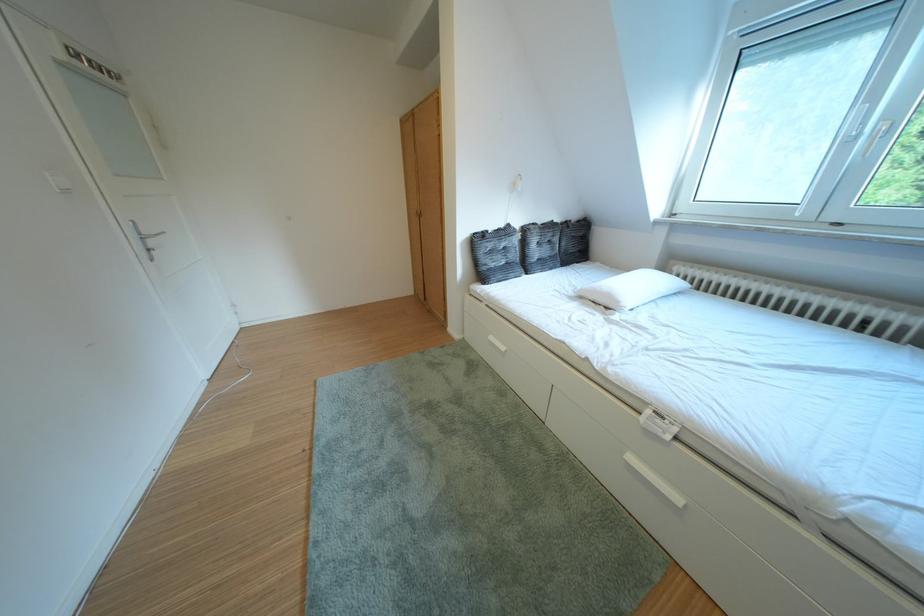
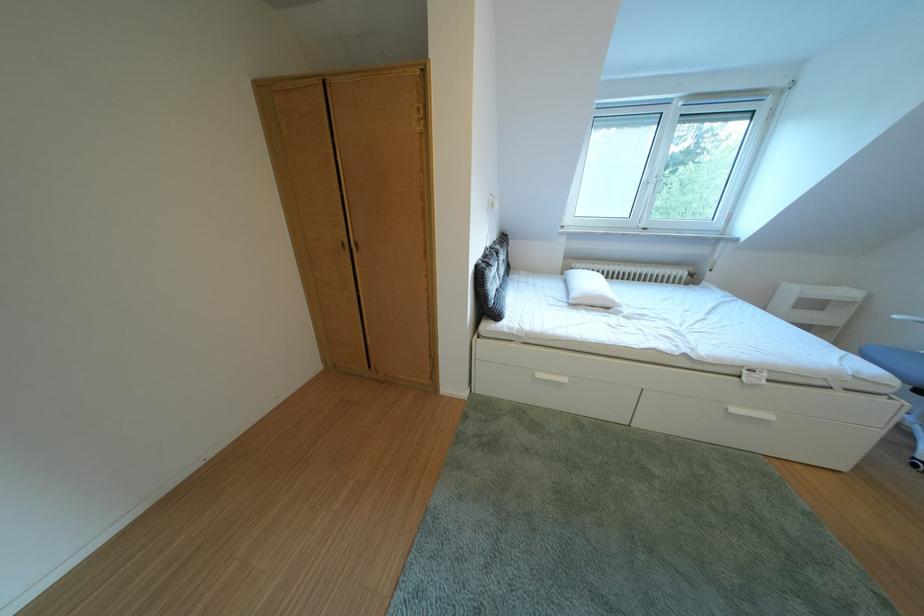
Locate, in the second image, the point that corresponds to [536,233] in the first image.

(505, 254)